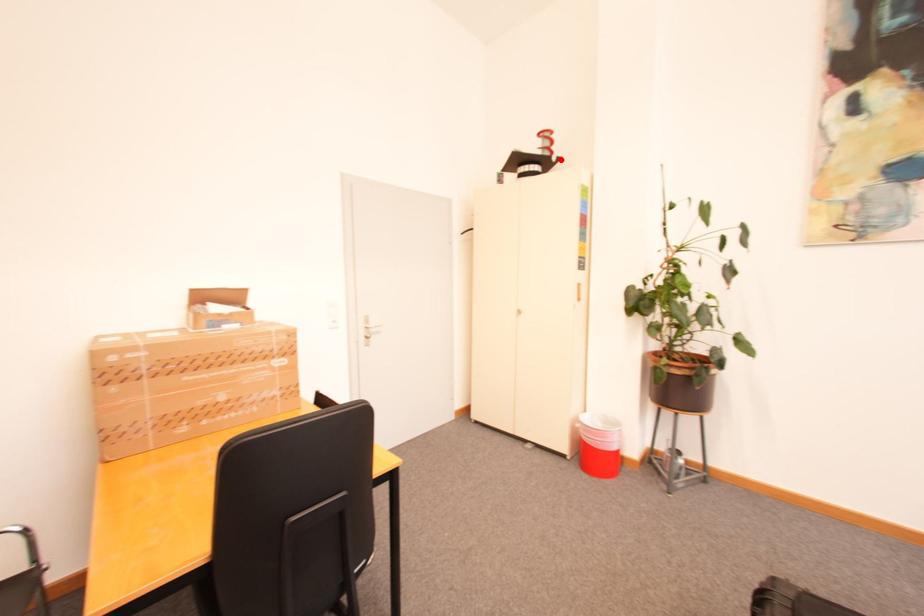
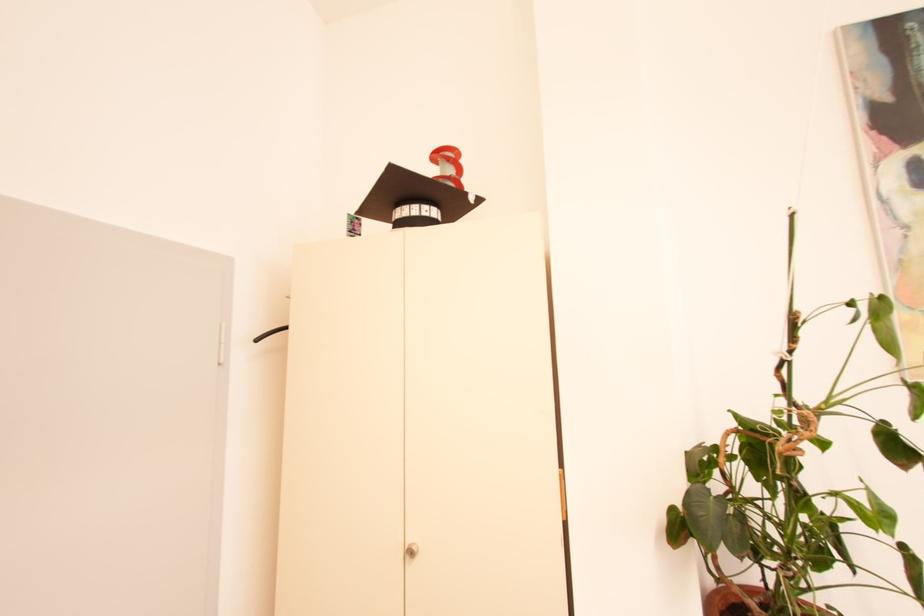
Find the pixel in the second image that matches the highlighted location in the first image.

(478, 199)